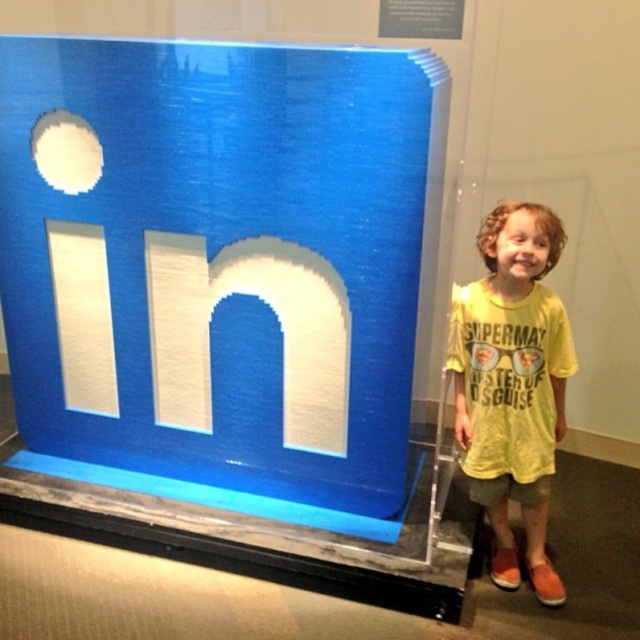
Question: Based on their relative distances, which object is farther from the yellow cotton shirt at right?

Choices:
 (A) white matte letter at center
 (B) white brushed metal letter n at center

Answer: (A)

Question: Considering the real-world distances, which object is farthest from the white brushed metal letter n at center?

Choices:
 (A) white matte letter at center
 (B) yellow cotton shirt at right

Answer: (B)

Question: Which is nearer to the white matte letter at center?

Choices:
 (A) yellow cotton shirt at right
 (B) white brushed metal letter n at center

Answer: (B)

Question: Is yellow cotton shirt at right wider than white brushed metal letter n at center?

Choices:
 (A) no
 (B) yes

Answer: (A)

Question: Can you confirm if yellow cotton shirt at right is positioned to the left of white matte letter at center?

Choices:
 (A) yes
 (B) no

Answer: (B)

Question: Does yellow cotton shirt at right appear on the left side of white matte letter at center?

Choices:
 (A) no
 (B) yes

Answer: (A)